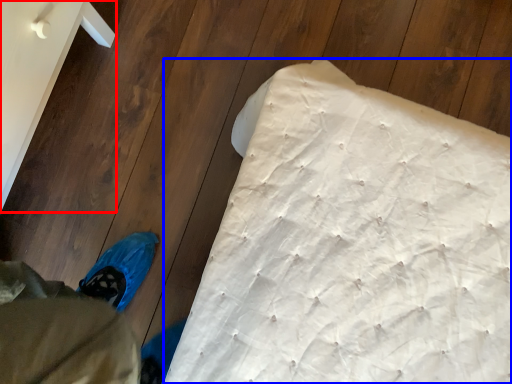
Question: Which of the following is the closest to the observer, furniture (highlighted by a red box) or mattress (highlighted by a blue box)?

Choices:
 (A) furniture
 (B) mattress

Answer: (A)